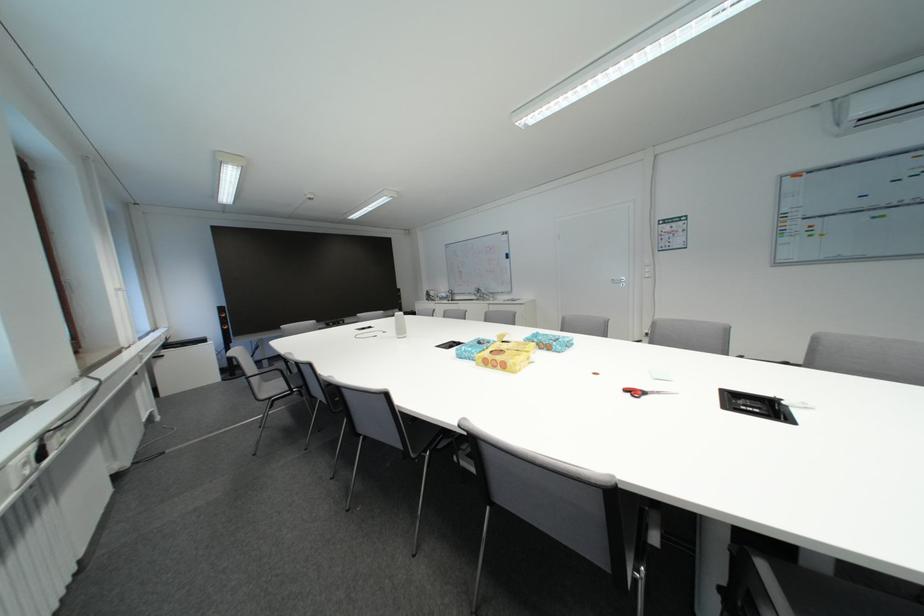
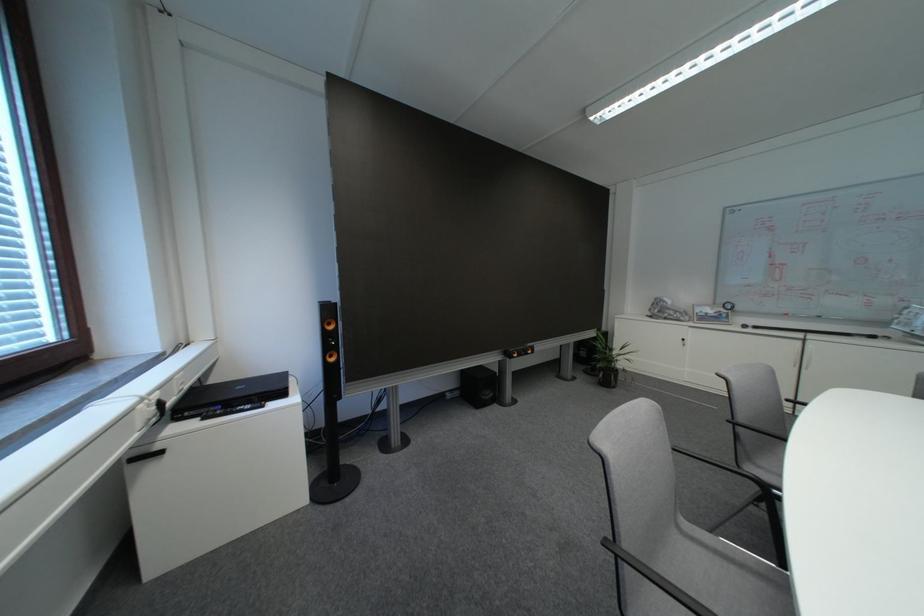
What movement of the cameraman would produce the second image?

The cameraman walked toward left, forward.